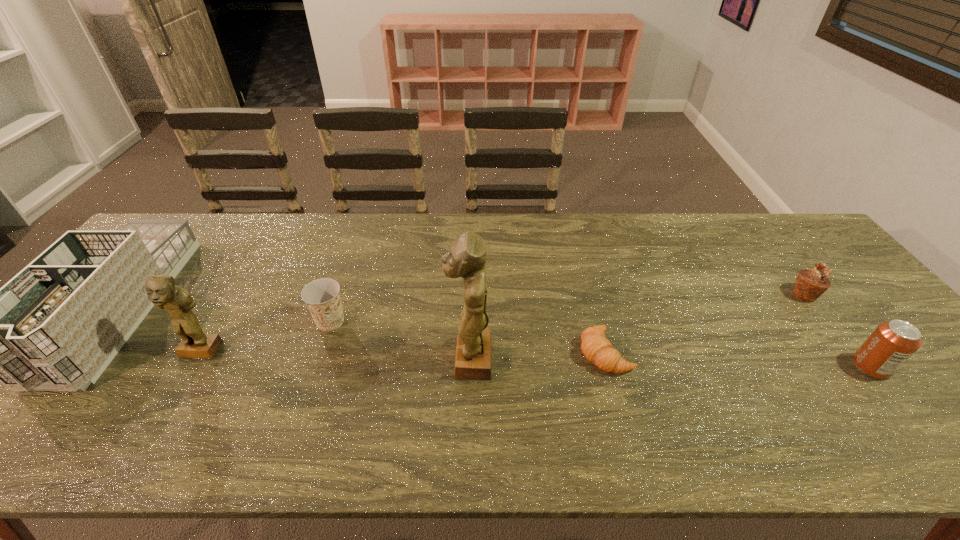
Please point a spot to add another figurine on the right. Please provide its 2D coordinates. Your answer should be formatted as a tuple, i.e. [(x, y)], where the tuple contains the x and y coordinates of a point satisfying the conditions above.

[(748, 366)]